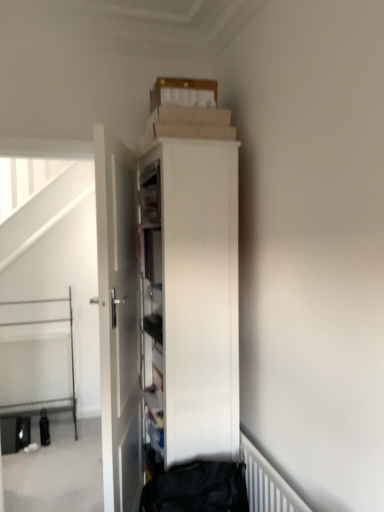
Question: Is white textured radiator at lower left, which appears as the first radiator when viewed from the back, smaller than white matte radiator at lower right, acting as the 2th radiator starting from the back?

Choices:
 (A) yes
 (B) no

Answer: (B)

Question: From a real-world perspective, is white textured radiator at lower left, placed as the second radiator when sorted from right to left, beneath white matte radiator at lower right, acting as the 2th radiator starting from the back?

Choices:
 (A) no
 (B) yes

Answer: (B)

Question: Is white textured radiator at lower left, acting as the first radiator starting from the left, thinner than white matte radiator at lower right, which ranks as the second radiator in left-to-right order?

Choices:
 (A) yes
 (B) no

Answer: (B)

Question: Can you confirm if white textured radiator at lower left, which appears as the first radiator when viewed from the back, is positioned to the left of white matte radiator at lower right, acting as the 2th radiator starting from the back?

Choices:
 (A) yes
 (B) no

Answer: (A)

Question: Considering the relative positions of white textured radiator at lower left, acting as the first radiator starting from the left, and white matte radiator at lower right, the 1th radiator from the front, in the image provided, is white textured radiator at lower left, acting as the first radiator starting from the left, behind white matte radiator at lower right, the 1th radiator from the front,?

Choices:
 (A) no
 (B) yes

Answer: (B)

Question: Would you say white glossy cabinet at center is inside or outside white metal bed at lower left?

Choices:
 (A) inside
 (B) outside

Answer: (B)

Question: Based on their positions, is white glossy cabinet at center located to the left or right of white metal bed at lower left?

Choices:
 (A) left
 (B) right

Answer: (B)

Question: From the image's perspective, is white glossy cabinet at center located above or below white metal bed at lower left?

Choices:
 (A) above
 (B) below

Answer: (A)

Question: Is white glossy cabinet at center wider or thinner than white metal bed at lower left?

Choices:
 (A) thin
 (B) wide

Answer: (B)

Question: Do you think white glossy door at center is within white matte radiator at lower right, the 1th radiator from the front, or outside of it?

Choices:
 (A) inside
 (B) outside

Answer: (B)

Question: Considering their positions, is white glossy door at center located in front of or behind white matte radiator at lower right, which ranks as the second radiator in left-to-right order?

Choices:
 (A) front
 (B) behind

Answer: (B)

Question: In the image, is white glossy door at center on the left side or the right side of white matte radiator at lower right, the 1th radiator from the front?

Choices:
 (A) right
 (B) left

Answer: (B)

Question: In terms of width, does white glossy door at center look wider or thinner when compared to white matte radiator at lower right, which ranks as the second radiator in left-to-right order?

Choices:
 (A) wide
 (B) thin

Answer: (A)

Question: From the image's perspective, is white glossy cabinet at center located above or below white glossy door at center?

Choices:
 (A) above
 (B) below

Answer: (A)

Question: Considering the relative positions of white glossy cabinet at center and white glossy door at center in the image provided, is white glossy cabinet at center to the left or to the right of white glossy door at center?

Choices:
 (A) right
 (B) left

Answer: (A)